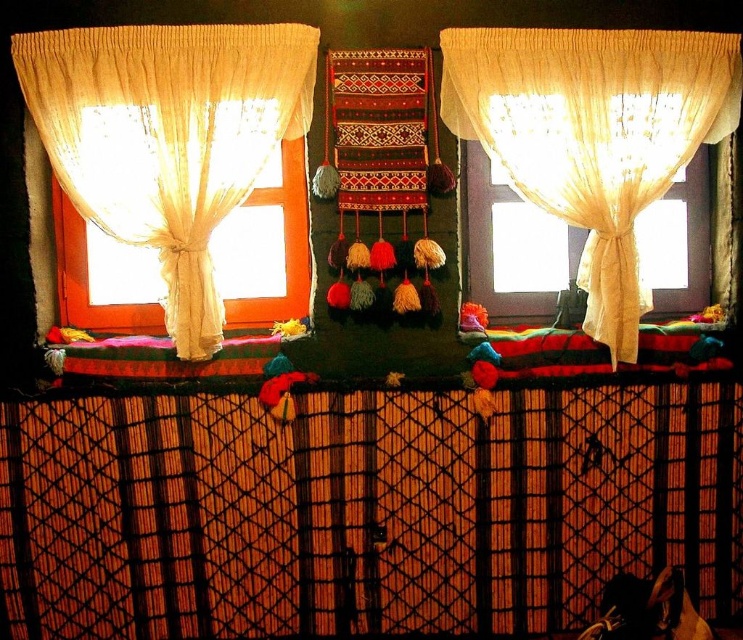
You are an interior designer planning to install a new wall decoration between the two translucent fabrics. The decoration requires a minimum of 36 inches of space. Can the space between the translucent beige fabric at left and the translucent fabric at right accommodate this decoration?

The translucent beige fabric at left is 36.40 inches away from the translucent fabric at right, which is just enough to accommodate the decoration requiring a minimum of 36 inches of space.

You are an interior designer assessing the space between the two windows. You need to determine which of the two curtains, the translucent beige fabric at left or the translucent white curtain at upper center, is narrower. Which one is narrower?

The translucent beige fabric at left is narrower than the translucent white curtain at upper center.

You are an interior designer planning to replace the translucent beige fabric at left and the translucent fabric at right with new ones. If you want both new fabrics to have the same width, which original fabric should you use as a reference for the size?

You should use the translucent beige fabric at left as a reference because its width is larger than the translucent fabric at right, so adjusting the smaller one to match the larger would maintain balance.